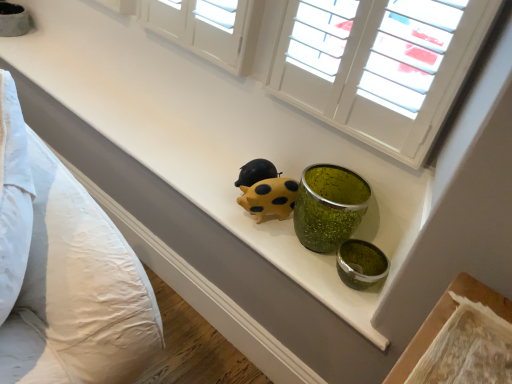
Question: From the image's perspective, is white textured shutters at upper center located above or below white cotton pillows at left?

Choices:
 (A) below
 (B) above

Answer: (B)

Question: In the image, is white textured shutters at upper center positioned in front of or behind white cotton pillows at left?

Choices:
 (A) front
 (B) behind

Answer: (B)

Question: Estimate the real-world distances between objects in this image. Which object is farther from the white textured shutters at upper center?

Choices:
 (A) yellow matte rubber ladybug at center
 (B) white cotton pillows at left

Answer: (B)

Question: Which object is the farthest from the white textured shutters at upper center?

Choices:
 (A) white cotton pillows at left
 (B) yellow matte rubber ladybug at center

Answer: (A)